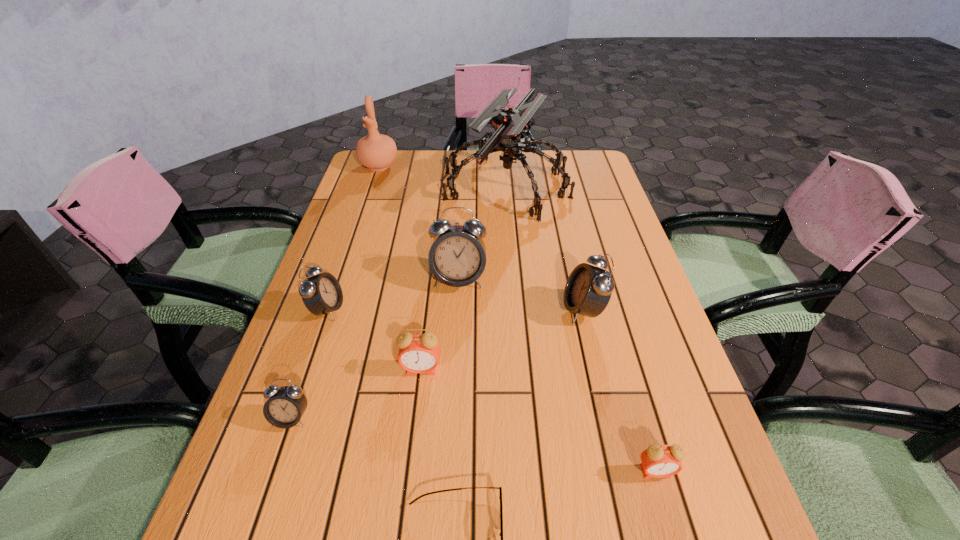
Find the location of a particular element. Image resolution: width=960 pixels, height=540 pixels. the nearest white alarm clock is located at coordinates (285, 406).

Locate an element on the screen. the nearer pink alarm clock is located at coordinates (657, 461).

Locate an element on the screen. This screenshot has width=960, height=540. the nearest alarm clock is located at coordinates (657, 461).

The image size is (960, 540). I want to click on vacant space located on the front of the drone, so click(512, 239).

Where is `free space located 0.210m on the spout of the pottery`? This screenshot has height=540, width=960. free space located 0.210m on the spout of the pottery is located at coordinates (363, 213).

At what (x,y) coordinates should I click in order to perform the action: click on vacant space situated on the face of the seventh shortest object. Please return your answer as a coordinate pair (x, y). This screenshot has width=960, height=540. Looking at the image, I should click on (453, 394).

You are a GUI agent. You are given a task and a screenshot of the screen. Output one action in this format:
    pyautogui.click(x=<x>, y=<y>)
    Task: Click on the vacant area situated 0.320m on the face of the rightmost white alarm clock
    
    Given the screenshot: What is the action you would take?
    pyautogui.click(x=423, y=309)

At what (x,y) coordinates should I click in order to perform the action: click on vacant space located on the face of the rightmost white alarm clock. Please return your answer as a coordinate pair (x, y). This screenshot has height=540, width=960. Looking at the image, I should click on (393, 309).

Where is `vacant space located on the face of the rightmost white alarm clock`? This screenshot has width=960, height=540. vacant space located on the face of the rightmost white alarm clock is located at coordinates [396, 309].

What are the coordinates of `free space located 0.110m on the face of the second smallest white alarm clock` in the screenshot? It's located at (392, 309).